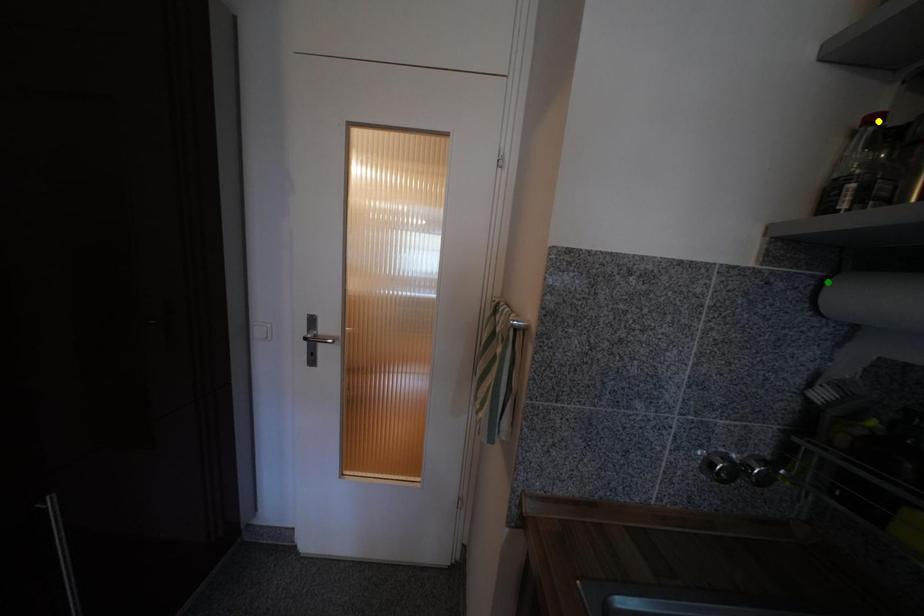
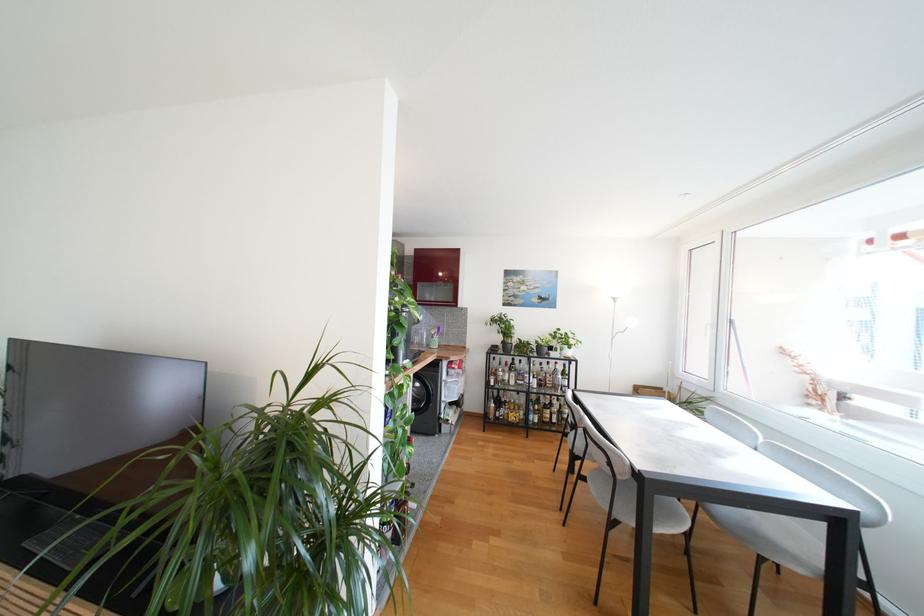
I am providing you with two images of the same scene from different viewpoints. Three points are marked in image1. Which point corresponds to a part or object that is occluded in image2?In image1, three points are marked. Which of them correspond to a part or object that is occluded in image2?Among the three points shown in image1, which one corresponds to a part or object that is no longer visible due to occlusion in image2?

blue point, yellow point, green point